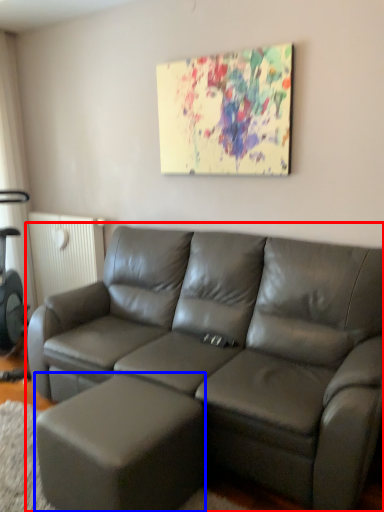
Question: Which object appears farthest to the camera in this image, studio couch (highlighted by a red box) or bar stool (highlighted by a blue box)?

Choices:
 (A) studio couch
 (B) bar stool

Answer: (B)